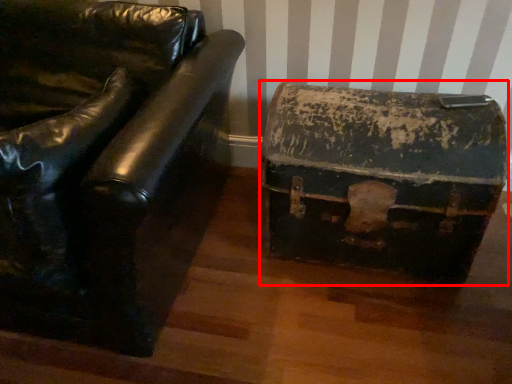
Question: From the image's perspective, where is storage box (annotated by the red box) located in relation to furniture in the image?

Choices:
 (A) above
 (B) below

Answer: (B)